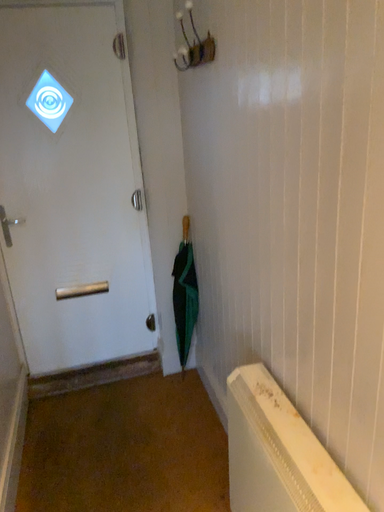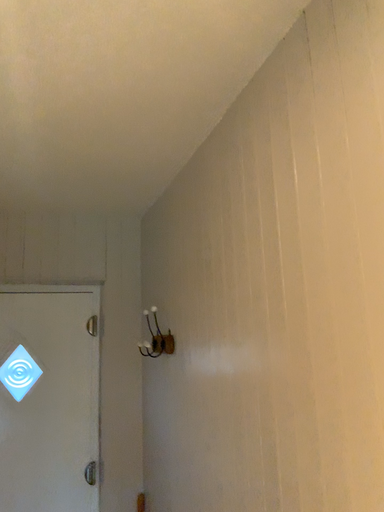
Question: How did the camera likely rotate when shooting the video?

Choices:
 (A) rotated downward
 (B) rotated upward

Answer: (B)